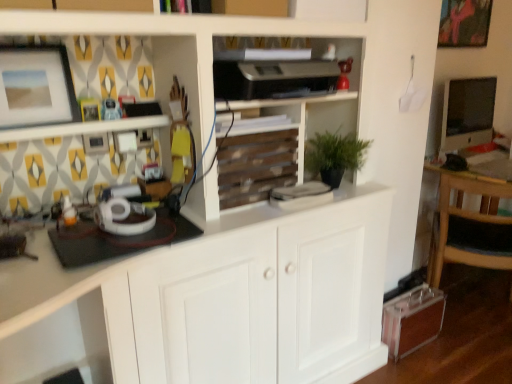
How much space does matte white picture frame at upper left, which is the 1th picture frame from left to right, occupy vertically?

It is 24.24 centimeters.

Image resolution: width=512 pixels, height=384 pixels. What do you see at coordinates (467, 113) in the screenshot?
I see `matte black monitor at right` at bounding box center [467, 113].

Image resolution: width=512 pixels, height=384 pixels. Describe the element at coordinates (464, 23) in the screenshot. I see `matte pink painting at upper right, positioned as the first picture frame in right-to-left order` at that location.

This screenshot has height=384, width=512. What do you see at coordinates (255, 165) in the screenshot?
I see `wooden slats at center` at bounding box center [255, 165].

Identify the location of wooden slats at center. (255, 165).

Image resolution: width=512 pixels, height=384 pixels. What are the coordinates of `matte white picture frame at upper left, which appears as the second picture frame when viewed from the back` in the screenshot? It's located at (36, 86).

From the image's perspective, does matte pink painting at upper right, which is counted as the 1th picture frame, starting from the top, appear higher than matte black monitor at right?

Correct, matte pink painting at upper right, which is counted as the 1th picture frame, starting from the top, appears higher than matte black monitor at right in the image.

Which of these two, matte pink painting at upper right, the 2th picture frame viewed from the left, or matte black monitor at right, stands shorter?

matte pink painting at upper right, the 2th picture frame viewed from the left.

Which is correct: matte pink painting at upper right, which ranks as the 1th picture frame in back-to-front order, is inside matte black monitor at right, or outside of it?

matte pink painting at upper right, which ranks as the 1th picture frame in back-to-front order, is spatially situated outside matte black monitor at right.

Which object is positioned more to the right, matte pink painting at upper right, which ranks as the 1th picture frame in back-to-front order, or matte black monitor at right?

Positioned to the right is matte black monitor at right.

Is point (221, 157) in front of point (477, 193)?

Yes, it is in front of point (477, 193).

Between wooden slats at center and wooden chair at right, which one has smaller size?

wooden slats at center.

Can wooden chair at right be found inside wooden slats at center?

Definitely not — wooden chair at right is not inside wooden slats at center.

Is wooden slats at center aimed at wooden chair at right?

No, wooden slats at center is not facing towards wooden chair at right.

From the image's perspective, is matte white picture frame at upper left, which appears as the second picture frame when viewed from the back, positioned above or below matte pink painting at upper right, which is counted as the 1th picture frame, starting from the top?

matte white picture frame at upper left, which appears as the second picture frame when viewed from the back, is below matte pink painting at upper right, which is counted as the 1th picture frame, starting from the top.

From a real-world perspective, which object rests below the other?

matte white picture frame at upper left, which is the second picture frame from top to bottom, from a real-world perspective.

How many degrees apart are the facing directions of matte white picture frame at upper left, which is the first picture frame in bottom-to-top order, and matte pink painting at upper right, the 2th picture frame viewed from the left?

matte white picture frame at upper left, which is the first picture frame in bottom-to-top order, and matte pink painting at upper right, the 2th picture frame viewed from the left, are facing 0.571 degrees away from each other.

Which of these two, matte white picture frame at upper left, which appears as the second picture frame when viewed from the back, or matte pink painting at upper right, positioned as the first picture frame in right-to-left order, is wider?

matte white picture frame at upper left, which appears as the second picture frame when viewed from the back.

Where is `computer monitor that is above the wooden chair at right (from the image's perspective)`? computer monitor that is above the wooden chair at right (from the image's perspective) is located at coordinates (467, 113).

Could you tell me if wooden chair at right is facing matte black monitor at right?

Yes, wooden chair at right is turned towards matte black monitor at right.

From a real-world perspective, is wooden chair at right physically below matte black monitor at right?

Yes.

This screenshot has width=512, height=384. Identify the location of chair below the matte white picture frame at upper left, which is the second picture frame from top to bottom (from a real-world perspective). (470, 228).

Is wooden chair at right oriented away from matte white picture frame at upper left, which is the first picture frame in bottom-to-top order?

That's not correct — wooden chair at right is not looking away from matte white picture frame at upper left, which is the first picture frame in bottom-to-top order.

Which is more to the right, wooden chair at right or matte white picture frame at upper left, arranged as the first picture frame when viewed from the front?

From the viewer's perspective, wooden chair at right appears more on the right side.

Consider the image. What's the angular difference between matte black monitor at right and wooden slats at center's facing directions?

The angular difference between matte black monitor at right and wooden slats at center is 2.86 degrees.

Does point (454, 101) come behind point (265, 165)?

Yes, it is behind point (265, 165).

Is matte black monitor at right positioned with its back to wooden slats at center?

matte black monitor at right does not have its back to wooden slats at center.

Can we say matte white picture frame at upper left, which appears as the second picture frame when viewed from the back, lies outside wooden chair at right?

That's correct, matte white picture frame at upper left, which appears as the second picture frame when viewed from the back, is outside of wooden chair at right.

How much distance is there between matte white picture frame at upper left, which is the 1th picture frame from left to right, and wooden chair at right?

The distance of matte white picture frame at upper left, which is the 1th picture frame from left to right, from wooden chair at right is 5.83 feet.

The width and height of the screenshot is (512, 384). I want to click on chair below the matte white picture frame at upper left, the second picture frame positioned from the right (from the image's perspective), so click(470, 228).

From the picture: From a real-world perspective, is matte white picture frame at upper left, which is the 1th picture frame from left to right, physically located above or below wooden chair at right?

In terms of real-world spatial position, matte white picture frame at upper left, which is the 1th picture frame from left to right, is above wooden chair at right.

From the matte black monitor at right, count the 1st picture frame to the left and point to it. Please provide its 2D coordinates.

[(464, 23)]

You are a GUI agent. You are given a task and a screenshot of the screen. Output one action in this format:
    pyautogui.click(x=<x>, y=<y>)
    Task: Click on the chair behind the wooden slats at center
    The width and height of the screenshot is (512, 384).
    Given the screenshot: What is the action you would take?
    pyautogui.click(x=470, y=228)

Considering their positions, is matte white picture frame at upper left, arranged as the first picture frame when viewed from the front, positioned closer to matte pink painting at upper right, which ranks as the 1th picture frame in back-to-front order, than wooden chair at right?

wooden chair at right lies closer to matte pink painting at upper right, which ranks as the 1th picture frame in back-to-front order, than the other object.

From the image, which object appears to be nearer to matte black monitor at right, wooden slats at center or wooden chair at right?

wooden chair at right is positioned closer to the anchor matte black monitor at right.

Which object lies further to the anchor point wooden chair at right, matte white picture frame at upper left, which is the first picture frame in bottom-to-top order, or matte pink painting at upper right, positioned as the first picture frame in right-to-left order?

Among the two, matte white picture frame at upper left, which is the first picture frame in bottom-to-top order, is located further to wooden chair at right.

When comparing their distances from wooden chair at right, does matte white picture frame at upper left, which appears as the second picture frame when viewed from the back, or matte black monitor at right seem further?

matte white picture frame at upper left, which appears as the second picture frame when viewed from the back.

From the picture: When comparing their distances from matte pink painting at upper right, the second picture frame in the bottom-to-top sequence, does matte white picture frame at upper left, which is the first picture frame in bottom-to-top order, or matte black monitor at right seem closer?

matte black monitor at right is closer to matte pink painting at upper right, the second picture frame in the bottom-to-top sequence.

Looking at the image, which one is located further to wooden chair at right, wooden slats at center or matte black monitor at right?

wooden slats at center lies further to wooden chair at right than the other object.

From the image, which object appears to be nearer to matte black monitor at right, wooden slats at center or matte white picture frame at upper left, which is the second picture frame from top to bottom?

The object closer to matte black monitor at right is wooden slats at center.

When comparing their distances from matte pink painting at upper right, which appears as the 2th picture frame when viewed from the front, does wooden slats at center or matte black monitor at right seem closer?

matte black monitor at right lies closer to matte pink painting at upper right, which appears as the 2th picture frame when viewed from the front, than the other object.

Find the location of a particular element. chair situated between matte white picture frame at upper left, the second picture frame positioned from the right, and matte black monitor at right from left to right is located at coordinates click(x=470, y=228).

You are a GUI agent. You are given a task and a screenshot of the screen. Output one action in this format:
    pyautogui.click(x=<x>, y=<y>)
    Task: Click on the picture frame between matte white picture frame at upper left, arranged as the first picture frame when viewed from the front, and matte black monitor at right
    This screenshot has width=512, height=384.
    Given the screenshot: What is the action you would take?
    pyautogui.click(x=464, y=23)

The height and width of the screenshot is (384, 512). What are the coordinates of `shelf located between matte white picture frame at upper left, the second picture frame positioned from the right, and matte black monitor at right in the left-right direction` in the screenshot? It's located at [255, 165].

At what (x,y) coordinates should I click in order to perform the action: click on picture frame between wooden slats at center and matte black monitor at right. Please return your answer as a coordinate pair (x, y). The width and height of the screenshot is (512, 384). Looking at the image, I should click on (464, 23).